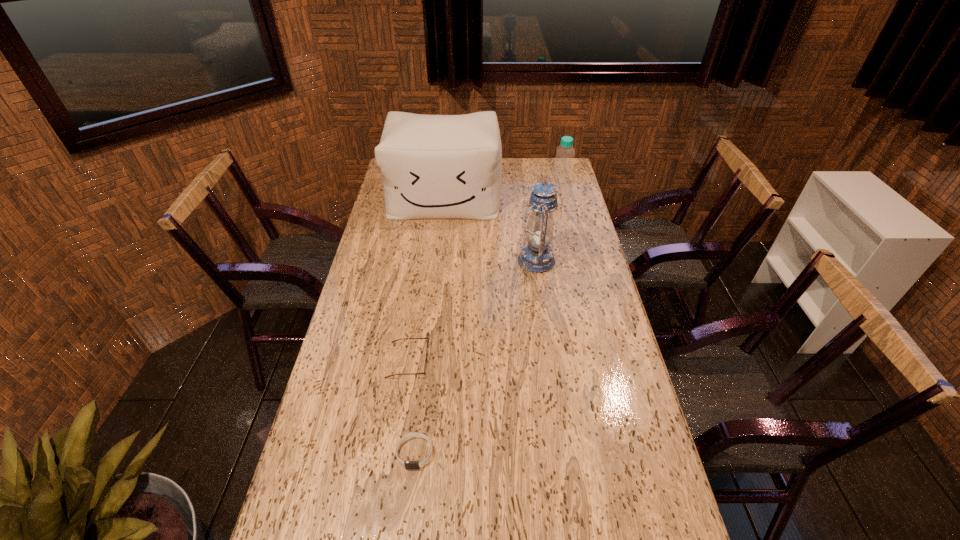
The image size is (960, 540). I want to click on vacant area that lies between the bottle and the nearest object, so click(489, 316).

Where is `empty location between the bottle and the cushion`? empty location between the bottle and the cushion is located at coordinates (503, 189).

Identify which object is located as the fourth nearest to the wristband. Please provide its 2D coordinates. Your answer should be formatted as a tuple, i.e. [(x, y)], where the tuple contains the x and y coordinates of a point satisfying the conditions above.

[(563, 167)]

Identify which object is located as the third nearest to the fourth farthest object. Please provide its 2D coordinates. Your answer should be formatted as a tuple, i.e. [(x, y)], where the tuple contains the x and y coordinates of a point satisfying the conditions above.

[(432, 166)]

Locate an element on the screen. Image resolution: width=960 pixels, height=540 pixels. vacant position in the image that satisfies the following two spatial constraints: 1. on the side of the cushion with the smiley face; 2. on the front-facing side of the fourth farthest object is located at coordinates (426, 361).

The height and width of the screenshot is (540, 960). I want to click on vacant area in the image that satisfies the following two spatial constraints: 1. on the side of the cushion with the smiley face; 2. on the front-facing side of the spectacles, so click(426, 361).